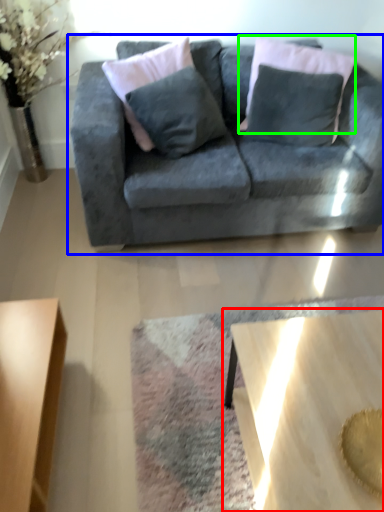
Question: Based on their relative distances, which object is nearer to coffee table (highlighted by a red box)? Choose from studio couch (highlighted by a blue box) and pillow (highlighted by a green box).

Choices:
 (A) studio couch
 (B) pillow

Answer: (A)